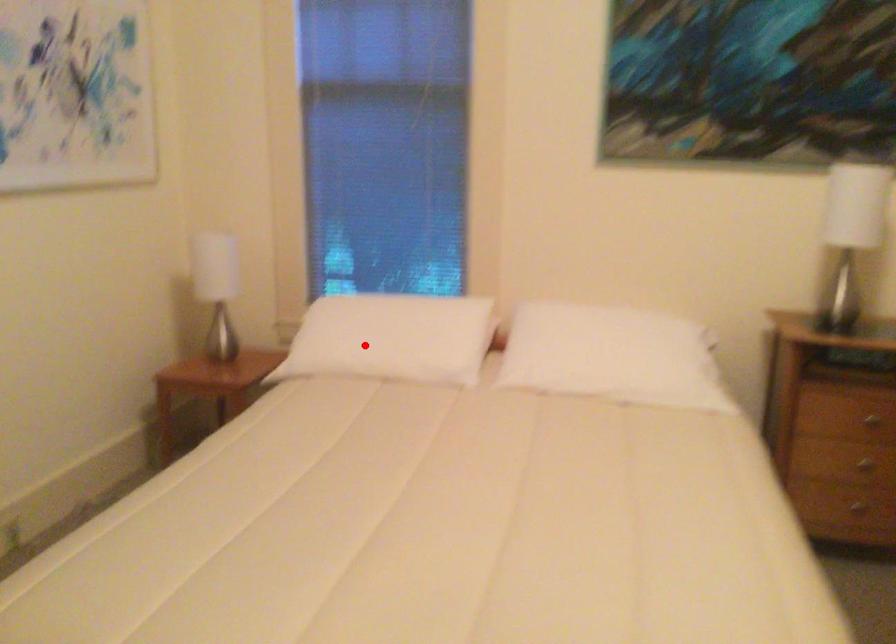
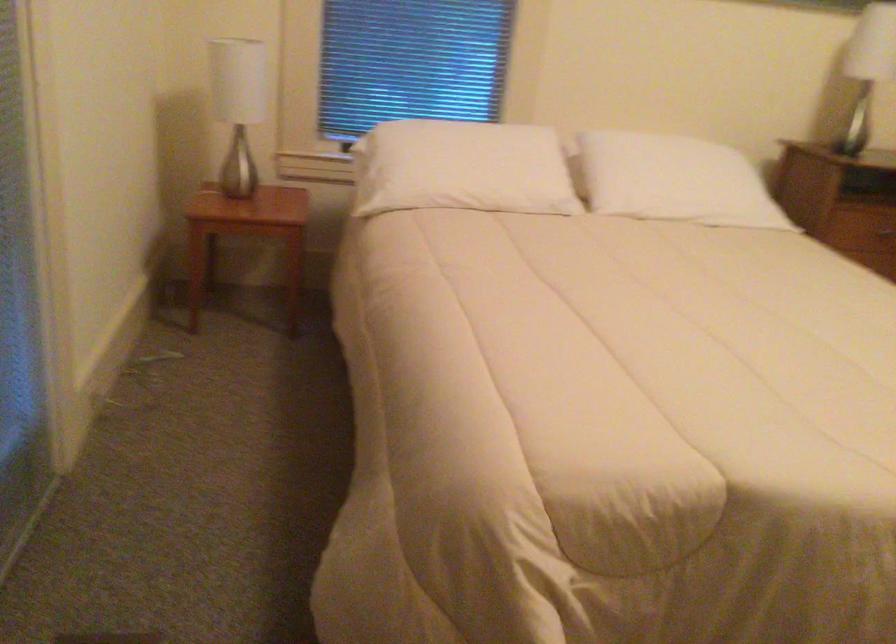
Question: I am providing you with two images of the same scene from different viewpoints. A red point is marked on the first image. Is the red point's position out of view in image 2?

Choices:
 (A) Yes
 (B) No

Answer: (B)